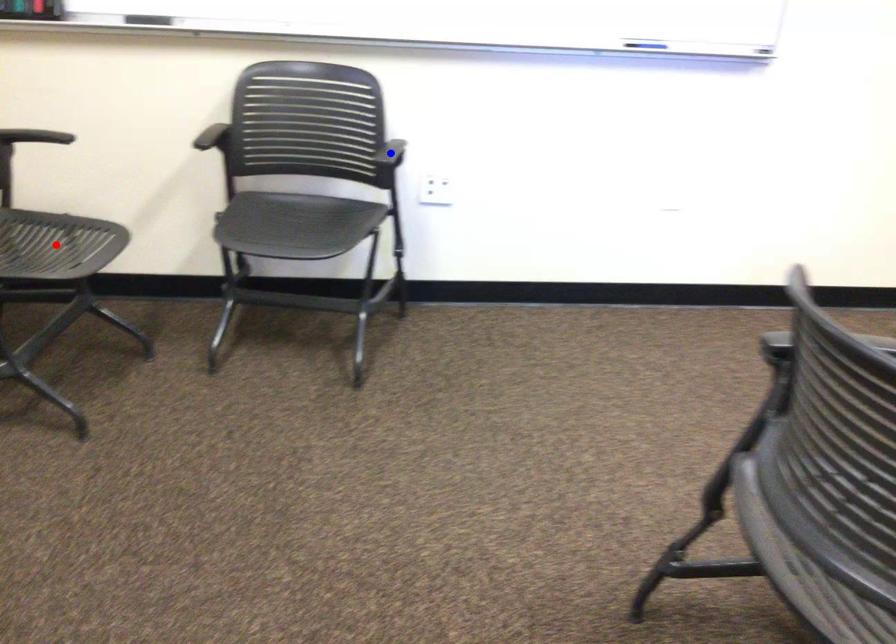
Question: Which of the two points in the image is closer to the camera?

Choices:
 (A) Blue point is closer.
 (B) Red point is closer.

Answer: (B)